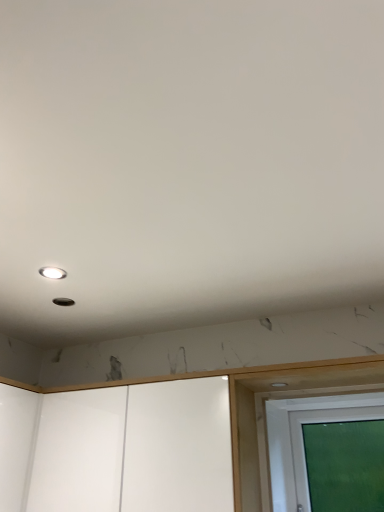
This screenshot has width=384, height=512. What do you see at coordinates (302, 438) in the screenshot? I see `transparent glass screen door at lower right, which is the 1th screen door in right-to-left order` at bounding box center [302, 438].

The height and width of the screenshot is (512, 384). Describe the element at coordinates (53, 272) in the screenshot. I see `matte white droplight at upper left` at that location.

Locate an element on the screen. Image resolution: width=384 pixels, height=512 pixels. transparent glass screen door at lower right, the 2th screen door in the left-to-right sequence is located at coordinates click(x=302, y=438).

From a real-world perspective, is white glossy cabinet at lower center, acting as the 2th screen door starting from the right, positioned under matte white droplight at upper left based on gravity?

Yes, from a real-world perspective, white glossy cabinet at lower center, acting as the 2th screen door starting from the right, is below matte white droplight at upper left.

In the scene shown: Do you think white glossy cabinet at lower center, which is counted as the first screen door, starting from the left, is within matte white droplight at upper left, or outside of it?

white glossy cabinet at lower center, which is counted as the first screen door, starting from the left, exists outside the volume of matte white droplight at upper left.

Are white glossy cabinet at lower center, acting as the 2th screen door starting from the right, and matte white droplight at upper left located far from each other?

No, white glossy cabinet at lower center, acting as the 2th screen door starting from the right, is not far from matte white droplight at upper left.

Consider the image. From the image's perspective, is white glossy cabinet at lower center, which is counted as the first screen door, starting from the left, above or below matte white droplight at upper left?

white glossy cabinet at lower center, which is counted as the first screen door, starting from the left, is situated lower than matte white droplight at upper left in the image.

In the scene shown: Considering the relative sizes of matte white droplight at upper left and transparent glass screen door at lower right, the 2th screen door in the left-to-right sequence, in the image provided, is matte white droplight at upper left bigger than transparent glass screen door at lower right, the 2th screen door in the left-to-right sequence,?

Actually, matte white droplight at upper left might be smaller than transparent glass screen door at lower right, the 2th screen door in the left-to-right sequence.

Based on their positions, is matte white droplight at upper left located to the left or right of transparent glass screen door at lower right, the 2th screen door in the left-to-right sequence?

matte white droplight at upper left is to the left of transparent glass screen door at lower right, the 2th screen door in the left-to-right sequence.

From a real-world perspective, which is physically above, matte white droplight at upper left or transparent glass screen door at lower right, the 2th screen door in the left-to-right sequence?

matte white droplight at upper left is physically above.

Based on the photo, what's the angular difference between matte white droplight at upper left and transparent glass screen door at lower right, which is the 1th screen door in right-to-left order,'s facing directions?

The angular difference between matte white droplight at upper left and transparent glass screen door at lower right, which is the 1th screen door in right-to-left order, is 91.7 degrees.

Would you say white glossy cabinet at lower center, acting as the 2th screen door starting from the right, is inside or outside transparent glass screen door at lower right, the 2th screen door in the left-to-right sequence?

white glossy cabinet at lower center, acting as the 2th screen door starting from the right, is located beyond the bounds of transparent glass screen door at lower right, the 2th screen door in the left-to-right sequence.

Who is bigger, white glossy cabinet at lower center, acting as the 2th screen door starting from the right, or transparent glass screen door at lower right, which is the 1th screen door in right-to-left order?

white glossy cabinet at lower center, acting as the 2th screen door starting from the right.

Locate an element on the screen. screen door above the transparent glass screen door at lower right, the 2th screen door in the left-to-right sequence (from the image's perspective) is located at coordinates pyautogui.click(x=136, y=449).

How different are the orientations of white glossy cabinet at lower center, acting as the 2th screen door starting from the right, and transparent glass screen door at lower right, the 2th screen door in the left-to-right sequence, in degrees?

0.0217 degrees separate the facing orientations of white glossy cabinet at lower center, acting as the 2th screen door starting from the right, and transparent glass screen door at lower right, the 2th screen door in the left-to-right sequence.

From a real-world perspective, who is located higher, matte white droplight at upper left or white glossy cabinet at lower center, acting as the 2th screen door starting from the right?

From a 3D spatial view, matte white droplight at upper left is above.

Are matte white droplight at upper left and white glossy cabinet at lower center, acting as the 2th screen door starting from the right, making contact?

No, matte white droplight at upper left is not next to white glossy cabinet at lower center, acting as the 2th screen door starting from the right.

I want to click on droplight above the white glossy cabinet at lower center, acting as the 2th screen door starting from the right (from the image's perspective), so click(x=53, y=272).

Can you confirm if matte white droplight at upper left is smaller than white glossy cabinet at lower center, which is counted as the first screen door, starting from the left?

Indeed, matte white droplight at upper left has a smaller size compared to white glossy cabinet at lower center, which is counted as the first screen door, starting from the left.

How different are the orientations of transparent glass screen door at lower right, the 2th screen door in the left-to-right sequence, and matte white droplight at upper left in degrees?

The angular difference between transparent glass screen door at lower right, the 2th screen door in the left-to-right sequence, and matte white droplight at upper left is 91.7 degrees.

From the picture: Can you confirm if transparent glass screen door at lower right, which is the 1th screen door in right-to-left order, is wider than matte white droplight at upper left?

Yes, transparent glass screen door at lower right, which is the 1th screen door in right-to-left order, is wider than matte white droplight at upper left.

Is transparent glass screen door at lower right, the 2th screen door in the left-to-right sequence, bigger than matte white droplight at upper left?

Yes.

Is transparent glass screen door at lower right, the 2th screen door in the left-to-right sequence, completely or partially outside of matte white droplight at upper left?

Indeed, transparent glass screen door at lower right, the 2th screen door in the left-to-right sequence, is completely outside matte white droplight at upper left.

Would you say transparent glass screen door at lower right, which is the 1th screen door in right-to-left order, is a long distance from white glossy cabinet at lower center, acting as the 2th screen door starting from the right?

No, transparent glass screen door at lower right, which is the 1th screen door in right-to-left order, is not far from white glossy cabinet at lower center, acting as the 2th screen door starting from the right.

Is transparent glass screen door at lower right, the 2th screen door in the left-to-right sequence, oriented away from white glossy cabinet at lower center, which is counted as the first screen door, starting from the left?

That's not correct — transparent glass screen door at lower right, the 2th screen door in the left-to-right sequence, is not looking away from white glossy cabinet at lower center, which is counted as the first screen door, starting from the left.

In terms of width, does transparent glass screen door at lower right, which is the 1th screen door in right-to-left order, look wider or thinner when compared to white glossy cabinet at lower center, which is counted as the first screen door, starting from the left?

Result: In the image, transparent glass screen door at lower right, which is the 1th screen door in right-to-left order, appears to be more narrow than white glossy cabinet at lower center, which is counted as the first screen door, starting from the left.

From the image's perspective, which one is positioned higher, transparent glass screen door at lower right, the 2th screen door in the left-to-right sequence, or white glossy cabinet at lower center, acting as the 2th screen door starting from the right?

white glossy cabinet at lower center, acting as the 2th screen door starting from the right, is shown above in the image.

At what (x,y) coordinates should I click in order to perform the action: click on the 1st screen door positioned below the matte white droplight at upper left (from a real-world perspective). Please return your answer as a coordinate pair (x, y). Looking at the image, I should click on (136, 449).

At what (x,y) coordinates should I click in order to perform the action: click on the 2nd screen door to the right when counting from the matte white droplight at upper left. Please return your answer as a coordinate pair (x, y). The width and height of the screenshot is (384, 512). Looking at the image, I should click on pos(302,438).

Estimate the real-world distances between objects in this image. Which object is closer to white glossy cabinet at lower center, acting as the 2th screen door starting from the right, transparent glass screen door at lower right, the 2th screen door in the left-to-right sequence, or matte white droplight at upper left?

transparent glass screen door at lower right, the 2th screen door in the left-to-right sequence.

From the image, which object appears to be farther from matte white droplight at upper left, white glossy cabinet at lower center, acting as the 2th screen door starting from the right, or transparent glass screen door at lower right, the 2th screen door in the left-to-right sequence?

Among the two, transparent glass screen door at lower right, the 2th screen door in the left-to-right sequence, is located further to matte white droplight at upper left.

Which object lies nearer to the anchor point matte white droplight at upper left, transparent glass screen door at lower right, the 2th screen door in the left-to-right sequence, or white glossy cabinet at lower center, acting as the 2th screen door starting from the right?

white glossy cabinet at lower center, acting as the 2th screen door starting from the right, lies closer to matte white droplight at upper left than the other object.

Looking at this image, which object lies further to the anchor point white glossy cabinet at lower center, which is counted as the first screen door, starting from the left, matte white droplight at upper left or transparent glass screen door at lower right, which is the 1th screen door in right-to-left order?

The object further to white glossy cabinet at lower center, which is counted as the first screen door, starting from the left, is matte white droplight at upper left.

From the image, which object appears to be farther from transparent glass screen door at lower right, which is the 1th screen door in right-to-left order, matte white droplight at upper left or white glossy cabinet at lower center, which is counted as the first screen door, starting from the left?

matte white droplight at upper left is positioned further to the anchor transparent glass screen door at lower right, which is the 1th screen door in right-to-left order.

Estimate the real-world distances between objects in this image. Which object is closer to transparent glass screen door at lower right, which is the 1th screen door in right-to-left order, white glossy cabinet at lower center, acting as the 2th screen door starting from the right, or matte white droplight at upper left?

white glossy cabinet at lower center, acting as the 2th screen door starting from the right, is positioned closer to the anchor transparent glass screen door at lower right, which is the 1th screen door in right-to-left order.

Find the location of a particular element. The height and width of the screenshot is (512, 384). screen door between matte white droplight at upper left and transparent glass screen door at lower right, the 2th screen door in the left-to-right sequence, from left to right is located at coordinates (136, 449).